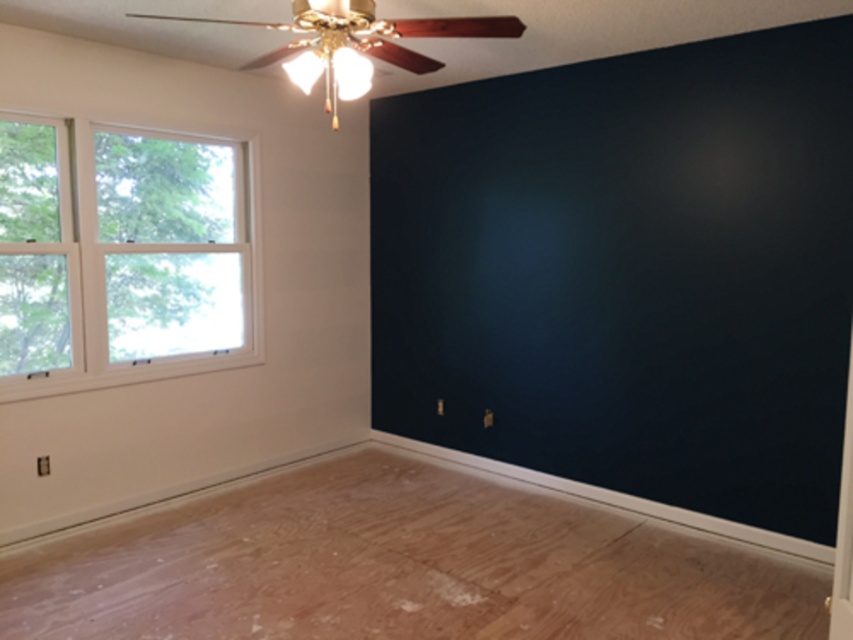
Based on the photo, you are standing in the room and want to walk from the natural wood floor at lower center to the clear glass window at left. Which direction should you move in to reach the window?

Since the natural wood floor at lower center is wider than the clear glass window at left, you should move to the left to reach the clear glass window at left from the natural wood floor at lower center.

You are standing in the room and want to place a tall potted plant on the natural wood floor at lower center. Considering the height of the clear glass window at left, will the plant be visible through the window from outside?

The natural wood floor at lower center has a lesser height compared to the clear glass window at left, so the tall potted plant placed on the natural wood floor at lower center will be visible through the clear glass window at left from outside.

You are standing in the room depicted in the scene. You want to place a small potted plant on the natural wood floor at lower center. Based on the coordinates provided, can you confirm if the point marked at (401,566) is the correct location for the natural wood floor at lower center?

Yes, the point marked at (401,566) corresponds to the natural wood floor at lower center, as stated in the Objects Description.